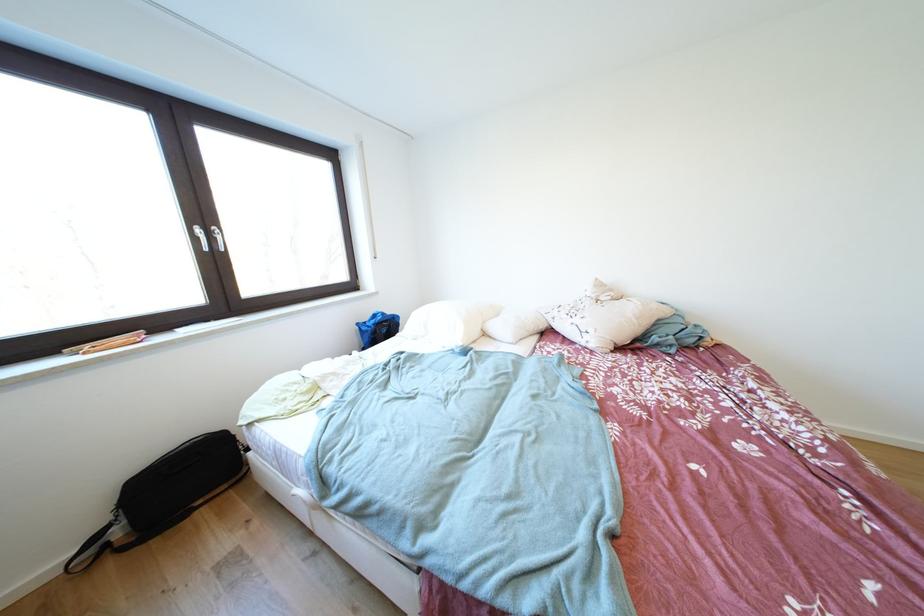
You are a GUI agent. You are given a task and a screenshot of the screen. Output one action in this format:
    pyautogui.click(x=<x>, y=<y>)
    Task: Click on the patterned pillow
    This screenshot has height=616, width=924.
    Given the screenshot: What is the action you would take?
    pyautogui.click(x=604, y=317)